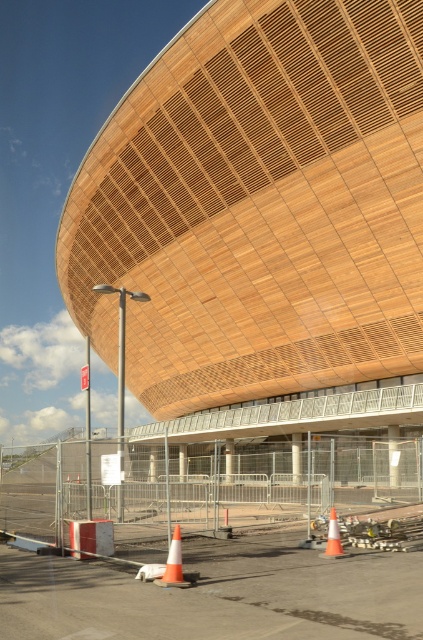
Question: Which point is farther to the camera?

Choices:
 (A) orange/reflective traffic cone at lower center
 (B) smooth asphalt tarmac at lower center
 (C) orange reflective cone at lower center

Answer: (C)

Question: Does smooth asphalt tarmac at lower center appear on the left side of orange/reflective traffic cone at lower center?

Choices:
 (A) yes
 (B) no

Answer: (B)

Question: Which of the following is the farthest from the observer?

Choices:
 (A) (327, 556)
 (B) (139, 556)

Answer: (B)

Question: Is smooth asphalt tarmac at lower center positioned before orange reflective cone at lower center?

Choices:
 (A) no
 (B) yes

Answer: (B)

Question: Which point is closer to the camera?

Choices:
 (A) coord(175,560)
 (B) coord(337,544)
 (C) coord(403,628)

Answer: (C)

Question: Is smooth asphalt tarmac at lower center bigger than orange reflective cone at lower center?

Choices:
 (A) no
 (B) yes

Answer: (B)